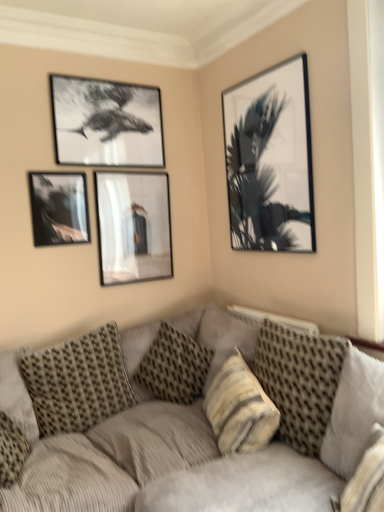
Image resolution: width=384 pixels, height=512 pixels. What do you see at coordinates (270, 160) in the screenshot?
I see `black matte picture frame at upper right, which is the fourth picture frame from left to right` at bounding box center [270, 160].

The image size is (384, 512). What do you see at coordinates (240, 408) in the screenshot?
I see `striped fabric pillow at center, the second pillow viewed from the right` at bounding box center [240, 408].

The image size is (384, 512). Describe the element at coordinates (59, 208) in the screenshot. I see `matte black picture frame at lower left, which is the 4th picture frame in right-to-left order` at that location.

In order to face matte glass picture frame at center, which appears as the third picture frame when viewed from the left, should I rotate leftwards or rightwards?

You should look left and rotate roughly 7.616 degrees.

Where is `textured beige pillow at lower left, which is the fifth pillow from right to left`? The height and width of the screenshot is (512, 384). textured beige pillow at lower left, which is the fifth pillow from right to left is located at coordinates (17, 394).

Based on the photo, is textured beige pillow at right, marked as the 5th pillow in a left-to-right arrangement, completely or partially inside matte glass picture frame at center, which appears as the third picture frame when viewed from the left?

No, textured beige pillow at right, marked as the 5th pillow in a left-to-right arrangement, is not inside matte glass picture frame at center, which appears as the third picture frame when viewed from the left.

From the image's perspective, is matte glass picture frame at center, placed as the second picture frame when sorted from right to left, located beneath textured beige pillow at right, arranged as the 1th pillow when viewed from the right?

Incorrect, from the image's perspective, matte glass picture frame at center, placed as the second picture frame when sorted from right to left, is higher than textured beige pillow at right, arranged as the 1th pillow when viewed from the right.

Image resolution: width=384 pixels, height=512 pixels. Identify the location of pillow that is the 1st one below the matte glass picture frame at center, placed as the second picture frame when sorted from right to left (from a real-world perspective). (353, 412).

Can you confirm if matte glass picture frame at center, placed as the second picture frame when sorted from right to left, is thinner than textured beige pillow at right, marked as the 5th pillow in a left-to-right arrangement?

Yes, matte glass picture frame at center, placed as the second picture frame when sorted from right to left, is thinner than textured beige pillow at right, marked as the 5th pillow in a left-to-right arrangement.

Is matte glass picture frame at center, placed as the second picture frame when sorted from right to left, oriented towards textured beige pillow at center, which is counted as the second pillow, starting from the left?

No, matte glass picture frame at center, placed as the second picture frame when sorted from right to left, is not aimed at textured beige pillow at center, which is counted as the second pillow, starting from the left.

Is matte glass picture frame at center, placed as the second picture frame when sorted from right to left, at the left side of textured beige pillow at center, which is counted as the second pillow, starting from the left?

Incorrect, matte glass picture frame at center, placed as the second picture frame when sorted from right to left, is not on the left side of textured beige pillow at center, which is counted as the second pillow, starting from the left.

From the image's perspective, which object appears higher, matte glass picture frame at center, which appears as the third picture frame when viewed from the left, or textured beige pillow at center, which is counted as the second pillow, starting from the left?

From the image's view, matte glass picture frame at center, which appears as the third picture frame when viewed from the left, is above.

Looking at this image, is textured beige pillow at center, which is counted as the 4th pillow, starting from the right, surrounded by matte glass picture frame at center, placed as the second picture frame when sorted from right to left?

No, textured beige pillow at center, which is counted as the 4th pillow, starting from the right, is not inside matte glass picture frame at center, placed as the second picture frame when sorted from right to left.

Considering the relative positions of matte black picture frame at lower left, which is the 4th picture frame in right-to-left order, and black glossy helicopter at upper left, the 2th picture frame when ordered from left to right, in the image provided, is matte black picture frame at lower left, which is the 4th picture frame in right-to-left order, in front of black glossy helicopter at upper left, the 2th picture frame when ordered from left to right,?

Yes, matte black picture frame at lower left, which is the 4th picture frame in right-to-left order, is in front of black glossy helicopter at upper left, the 2th picture frame when ordered from left to right.

Looking at the image, does matte black picture frame at lower left, the 1th picture frame positioned from the left, seem bigger or smaller compared to black glossy helicopter at upper left, the 2th picture frame when ordered from left to right?

Clearly, matte black picture frame at lower left, the 1th picture frame positioned from the left, is smaller in size than black glossy helicopter at upper left, the 2th picture frame when ordered from left to right.

From a real-world perspective, between matte black picture frame at lower left, which is the 4th picture frame in right-to-left order, and black glossy helicopter at upper left, the 3th picture frame from the right, who is vertically lower?

From a 3D spatial view, matte black picture frame at lower left, which is the 4th picture frame in right-to-left order, is below.

From the image's perspective, is matte black picture frame at lower left, which is the 4th picture frame in right-to-left order, positioned above or below black glossy helicopter at upper left, the 2th picture frame when ordered from left to right?

matte black picture frame at lower left, which is the 4th picture frame in right-to-left order, is below black glossy helicopter at upper left, the 2th picture frame when ordered from left to right.

Based on the photo, from a real-world perspective, is textured beige pillow at lower left, arranged as the first pillow when viewed from the left, under black matte picture frame at upper right, which appears as the first picture frame when viewed from the right?

Yes, from a real-world perspective, textured beige pillow at lower left, arranged as the first pillow when viewed from the left, is beneath black matte picture frame at upper right, which appears as the first picture frame when viewed from the right.

Considering the positions of point (33, 422) and point (257, 101), is point (33, 422) closer or farther from the camera than point (257, 101)?

Clearly, point (33, 422) is closer to the camera than point (257, 101).

What are the coordinates of `the 4th picture frame to the right of the textured beige pillow at lower left, which is the fifth pillow from right to left, starting your count from the anchor` in the screenshot? It's located at (270, 160).

Can you confirm if textured beige pillow at lower left, which is the fifth pillow from right to left, is shorter than black matte picture frame at upper right, which is the fourth picture frame from left to right?

Yes.

Is black matte picture frame at upper right, which appears as the first picture frame when viewed from the right, facing towards textured beige pillow at center, which is counted as the second pillow, starting from the left?

No, black matte picture frame at upper right, which appears as the first picture frame when viewed from the right, is not aimed at textured beige pillow at center, which is counted as the second pillow, starting from the left.

Considering the sizes of black matte picture frame at upper right, which is the fourth picture frame from left to right, and textured beige pillow at center, which is counted as the second pillow, starting from the left, in the image, is black matte picture frame at upper right, which is the fourth picture frame from left to right, taller or shorter than textured beige pillow at center, which is counted as the second pillow, starting from the left,?

black matte picture frame at upper right, which is the fourth picture frame from left to right, is taller than textured beige pillow at center, which is counted as the second pillow, starting from the left.

From the image's perspective, which is above, black matte picture frame at upper right, which appears as the first picture frame when viewed from the right, or textured beige pillow at center, which is counted as the 4th pillow, starting from the right?

black matte picture frame at upper right, which appears as the first picture frame when viewed from the right, is shown above in the image.

Considering the sizes of objects black matte picture frame at upper right, which appears as the first picture frame when viewed from the right, and textured beige pillow at right, marked as the 5th pillow in a left-to-right arrangement, in the image provided, who is thinner, black matte picture frame at upper right, which appears as the first picture frame when viewed from the right, or textured beige pillow at right, marked as the 5th pillow in a left-to-right arrangement,?

With smaller width is black matte picture frame at upper right, which appears as the first picture frame when viewed from the right.

Identify the location of pillow on the right of black matte picture frame at upper right, which appears as the first picture frame when viewed from the right. (353, 412).

Visually, is black matte picture frame at upper right, which is the fourth picture frame from left to right, positioned to the left or to the right of textured beige pillow at right, marked as the 5th pillow in a left-to-right arrangement?

In the image, black matte picture frame at upper right, which is the fourth picture frame from left to right, appears on the left side of textured beige pillow at right, marked as the 5th pillow in a left-to-right arrangement.

Is black matte picture frame at upper right, which is the fourth picture frame from left to right, positioned beyond the bounds of textured beige pillow at right, arranged as the 1th pillow when viewed from the right?

Yes.

Is textured corduroy couch at lower center completely or partially outside of matte glass picture frame at center, placed as the second picture frame when sorted from right to left?

Absolutely, textured corduroy couch at lower center is external to matte glass picture frame at center, placed as the second picture frame when sorted from right to left.

Is textured corduroy couch at lower center facing away from matte glass picture frame at center, placed as the second picture frame when sorted from right to left?

No, textured corduroy couch at lower center is not facing away from matte glass picture frame at center, placed as the second picture frame when sorted from right to left.

Is textured corduroy couch at lower center shorter than matte glass picture frame at center, placed as the second picture frame when sorted from right to left?

Incorrect, the height of textured corduroy couch at lower center does not fall short of that of matte glass picture frame at center, placed as the second picture frame when sorted from right to left.

Can you confirm if textured corduroy couch at lower center is bigger than matte glass picture frame at center, placed as the second picture frame when sorted from right to left?

Yes, textured corduroy couch at lower center is bigger than matte glass picture frame at center, placed as the second picture frame when sorted from right to left.

Image resolution: width=384 pixels, height=512 pixels. There is a matte glass picture frame at center, which appears as the third picture frame when viewed from the left. In order to click on the 2nd pillow below it (from the image's perspective) in this screenshot , I will do `click(353, 412)`.

Image resolution: width=384 pixels, height=512 pixels. I want to click on pillow that is the 4th one below the matte glass picture frame at center, placed as the second picture frame when sorted from right to left (from a real-world perspective), so click(x=78, y=382).

Looking at this image, estimate the real-world distances between objects in this image. Which object is closer to textured beige pillow at lower left, arranged as the first pillow when viewed from the left, textured beige pillow at right, marked as the 5th pillow in a left-to-right arrangement, or textured beige pillow at center, which is counted as the 4th pillow, starting from the right?

textured beige pillow at center, which is counted as the 4th pillow, starting from the right, is closer to textured beige pillow at lower left, arranged as the first pillow when viewed from the left.

From the image, which object appears to be nearer to textured beige pillow at right, marked as the 5th pillow in a left-to-right arrangement, black matte picture frame at upper right, which appears as the first picture frame when viewed from the right, or black glossy helicopter at upper left, the 2th picture frame when ordered from left to right?

black matte picture frame at upper right, which appears as the first picture frame when viewed from the right, lies closer to textured beige pillow at right, marked as the 5th pillow in a left-to-right arrangement, than the other object.

From the image, which object appears to be nearer to textured corduroy couch at lower center, textured beige pillow at center, which is counted as the second pillow, starting from the left, or matte black picture frame at lower left, which is the 4th picture frame in right-to-left order?

textured beige pillow at center, which is counted as the second pillow, starting from the left, lies closer to textured corduroy couch at lower center than the other object.

Considering their positions, is patterned fabric pillow at center, positioned as the third pillow in right-to-left order, positioned further to textured corduroy couch at lower center than textured beige pillow at center, which is counted as the 4th pillow, starting from the right?

Based on the image, textured beige pillow at center, which is counted as the 4th pillow, starting from the right, appears to be further to textured corduroy couch at lower center.

Estimate the real-world distances between objects in this image. Which object is closer to textured corduroy couch at lower center, black matte picture frame at upper right, which appears as the first picture frame when viewed from the right, or striped fabric pillow at center, arranged as the 4th pillow when viewed from the left?

Among the two, striped fabric pillow at center, arranged as the 4th pillow when viewed from the left, is located nearer to textured corduroy couch at lower center.

Based on their spatial positions, is black matte picture frame at upper right, which is the fourth picture frame from left to right, or matte glass picture frame at center, which appears as the third picture frame when viewed from the left, closer to textured beige pillow at right, marked as the 5th pillow in a left-to-right arrangement?

black matte picture frame at upper right, which is the fourth picture frame from left to right, lies closer to textured beige pillow at right, marked as the 5th pillow in a left-to-right arrangement, than the other object.

Based on their spatial positions, is textured corduroy couch at lower center or striped fabric pillow at center, arranged as the 4th pillow when viewed from the left, further from black glossy helicopter at upper left, the 3th picture frame from the right?

striped fabric pillow at center, arranged as the 4th pillow when viewed from the left, is positioned further to the anchor black glossy helicopter at upper left, the 3th picture frame from the right.

From the image, which object appears to be nearer to matte black picture frame at lower left, the 1th picture frame positioned from the left, textured beige pillow at center, which is counted as the 4th pillow, starting from the right, or textured corduroy couch at lower center?

Based on the image, textured beige pillow at center, which is counted as the 4th pillow, starting from the right, appears to be nearer to matte black picture frame at lower left, the 1th picture frame positioned from the left.

You are a GUI agent. You are given a task and a screenshot of the screen. Output one action in this format:
    pyautogui.click(x=<x>, y=<y>)
    Task: Click on the pillow between black glossy helicopter at upper left, the 3th picture frame from the right, and textured beige pillow at right, arranged as the 1th pillow when viewed from the right, in the up-down direction
    This screenshot has width=384, height=512.
    Given the screenshot: What is the action you would take?
    [174, 367]

Locate an element on the screen. picture frame between black glossy helicopter at upper left, the 3th picture frame from the right, and black matte picture frame at upper right, which is the fourth picture frame from left to right, from left to right is located at coordinates (133, 226).

This screenshot has height=512, width=384. I want to click on pillow between textured beige pillow at center, which is counted as the 4th pillow, starting from the right, and striped fabric pillow at center, the second pillow viewed from the right, so click(x=174, y=367).

At what (x,y) coordinates should I click in order to perform the action: click on pillow between black matte picture frame at upper right, which is the fourth picture frame from left to right, and textured beige pillow at right, marked as the 5th pillow in a left-to-right arrangement, vertically. Please return your answer as a coordinate pair (x, y). This screenshot has height=512, width=384. Looking at the image, I should click on (174, 367).